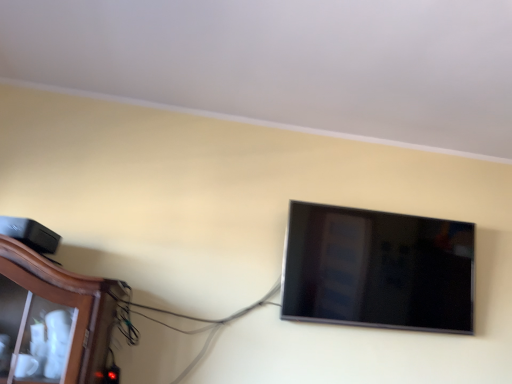
Describe the element at coordinates (378, 269) in the screenshot. The width and height of the screenshot is (512, 384). I see `black glossy tv at upper right` at that location.

The height and width of the screenshot is (384, 512). Find the location of `black glossy tv at upper right`. black glossy tv at upper right is located at coordinates (378, 269).

This screenshot has width=512, height=384. I want to click on black glossy tv at upper right, so click(x=378, y=269).